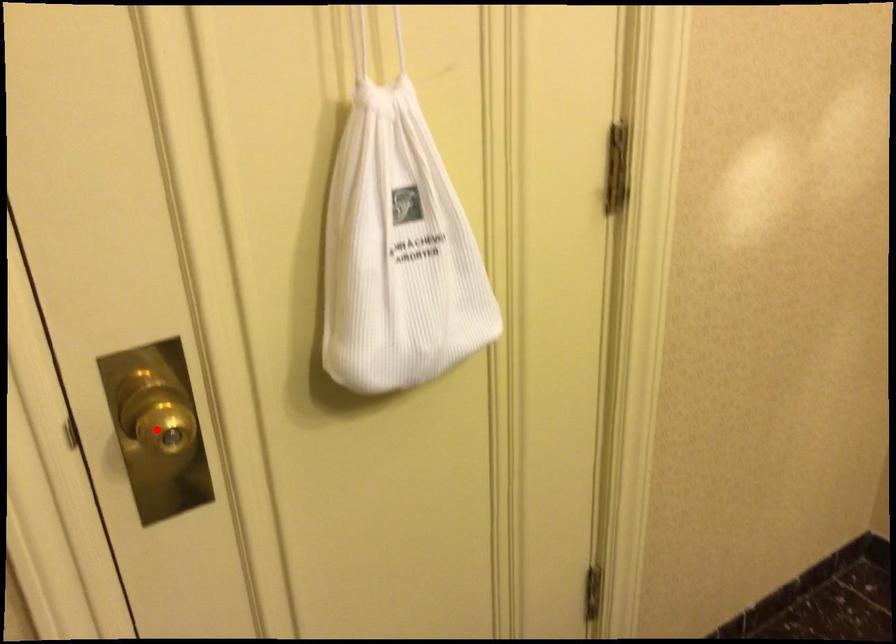
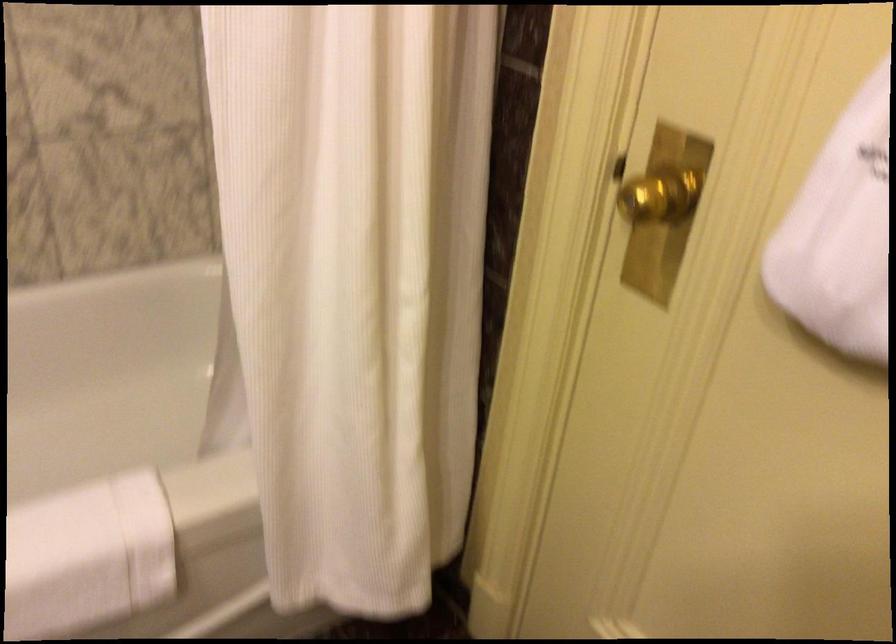
Question: I am providing you with two images of the same scene from different viewpoints. A red point is shown in image1. For the corresponding object point in image2, is it positioned nearer or farther from the camera?

Choices:
 (A) Nearer
 (B) Farther

Answer: (B)